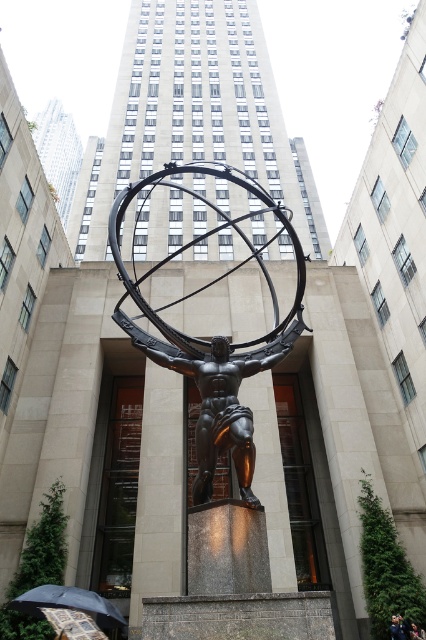
Question: Among these points, which one is nearest to the camera?

Choices:
 (A) (411, 634)
 (B) (402, 637)
 (C) (120, 620)

Answer: (C)

Question: Does bronze statue at center appear on the right side of dark blue jacket at lower right?

Choices:
 (A) yes
 (B) no

Answer: (B)

Question: Which object is positioned farthest from the shiny bronze statue at center?

Choices:
 (A) black fabric umbrella at lower left
 (B) bronze statue at center

Answer: (A)

Question: Can you confirm if bronze statue at center is wider than shiny bronze statue at center?

Choices:
 (A) no
 (B) yes

Answer: (B)

Question: Does black fabric umbrella at lower left have a smaller size compared to dark blue fabric person at center?

Choices:
 (A) no
 (B) yes

Answer: (A)

Question: Based on their relative distances, which object is farther from the shiny bronze statue at center?

Choices:
 (A) dark blue jacket at lower right
 (B) bronze statue at center

Answer: (A)